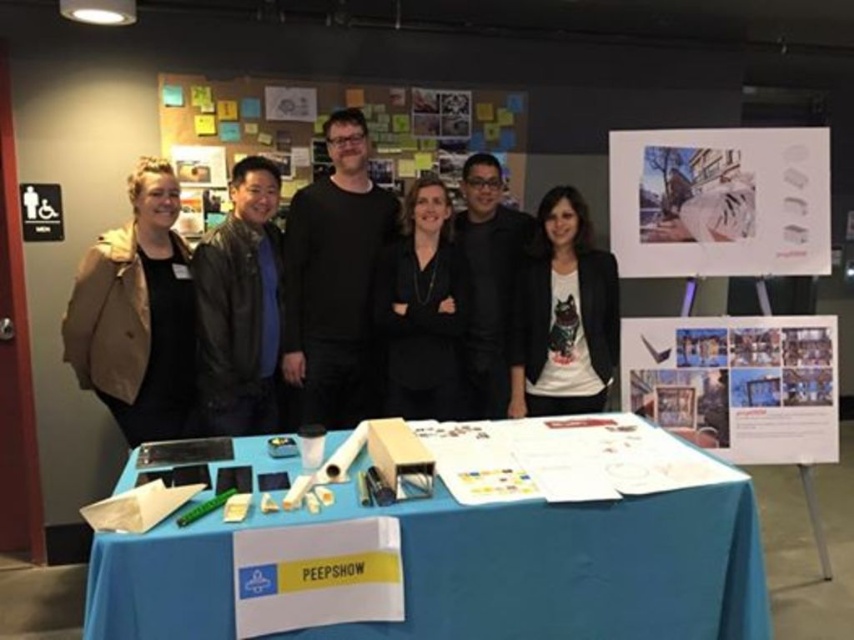
Question: Can you confirm if leather jacket at center is positioned below white matte shirt at center?

Choices:
 (A) no
 (B) yes

Answer: (A)

Question: Among these objects, which one is nearest to the camera?

Choices:
 (A) matte paper poster at center
 (B) black matte jacket at center
 (C) black matte shirt at center
 (D) white paper at upper right

Answer: (C)

Question: Which is farther from the black matte/black shirt at center?

Choices:
 (A) white paper at upper right
 (B) leather jacket at center
 (C) black matte jacket at center
 (D) matte paper poster at center

Answer: (D)

Question: Can you confirm if multicolored paper notes at center is positioned above black matte jacket at center?

Choices:
 (A) yes
 (B) no

Answer: (A)

Question: Among these points, which one is farthest from the camera?

Choices:
 (A) (796, 445)
 (B) (285, 88)
 (C) (82, 300)
 (D) (744, 273)

Answer: (B)

Question: Does matte paper poster at center appear on the left side of leather jacket at center?

Choices:
 (A) yes
 (B) no

Answer: (B)